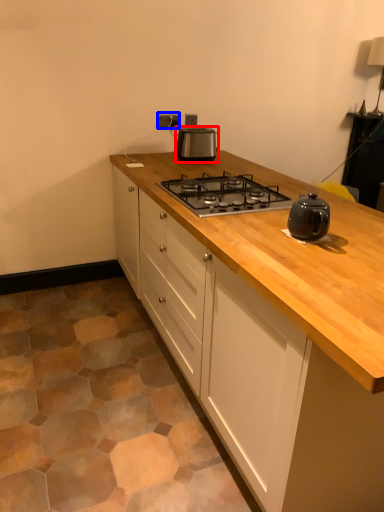
Question: Among these objects, which one is farthest to the camera, kitchen appliance (highlighted by a red box) or electric outlet (highlighted by a blue box)?

Choices:
 (A) kitchen appliance
 (B) electric outlet

Answer: (B)